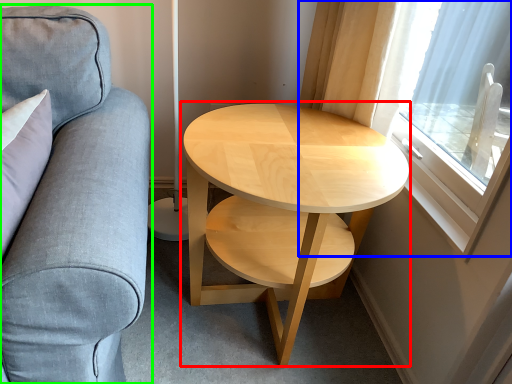
Question: Considering the real-world distances, which object is closest to coffee table (highlighted by a red box)? window (highlighted by a blue box) or studio couch (highlighted by a green box).

Choices:
 (A) window
 (B) studio couch

Answer: (A)